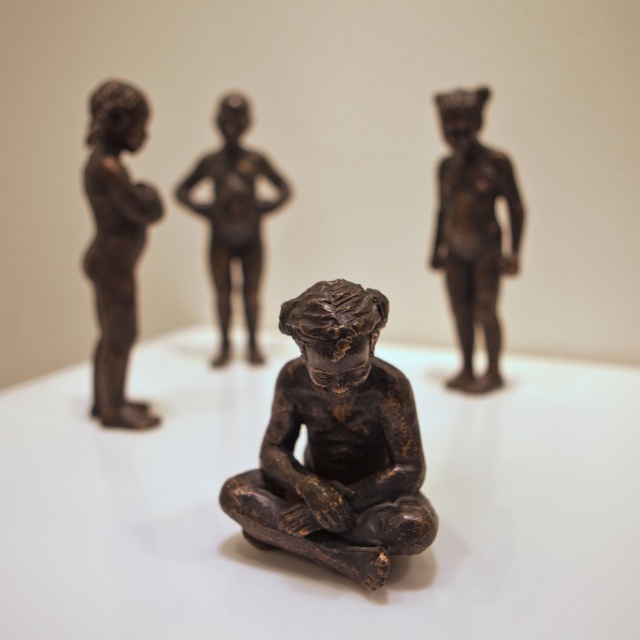
Question: Which is nearer to the matte bronze figure at center?

Choices:
 (A) bronze statue at left
 (B) bronze statue at upper right

Answer: (A)

Question: Does bronze statue at center have a larger size compared to bronze statue at upper right?

Choices:
 (A) no
 (B) yes

Answer: (B)

Question: Can you confirm if bronze statue at left is positioned to the right of matte bronze figure at center?

Choices:
 (A) yes
 (B) no

Answer: (B)

Question: Which point is closer to the camera?

Choices:
 (A) bronze statue at left
 (B) bronze statue at upper right
 (C) bronze statue at center

Answer: (C)

Question: Considering the real-world distances, which object is closest to the bronze statue at upper right?

Choices:
 (A) matte bronze figure at center
 (B) bronze statue at center
 (C) bronze statue at left

Answer: (A)

Question: Does bronze statue at center appear under bronze statue at upper right?

Choices:
 (A) no
 (B) yes

Answer: (B)